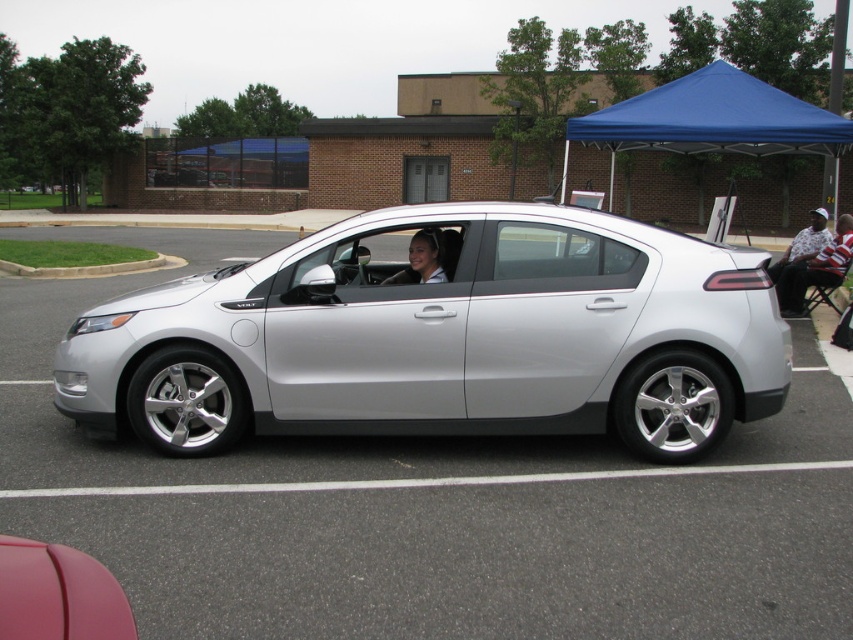
The height and width of the screenshot is (640, 853). What do you see at coordinates (712, 118) in the screenshot?
I see `blue fabric canopy at upper right` at bounding box center [712, 118].

Between point (669, 136) and point (413, 241), which one is positioned behind?

The point (669, 136) is more distant.

Is point (666, 86) farther from camera compared to point (412, 240)?

Yes, it is behind point (412, 240).

You are a GUI agent. You are given a task and a screenshot of the screen. Output one action in this format:
    pyautogui.click(x=<x>, y=<y>)
    Task: Click on the blue fabric canopy at upper right
    This screenshot has width=853, height=640.
    Given the screenshot: What is the action you would take?
    pyautogui.click(x=712, y=118)

Who is taller, silver metallic sedan at center or blue fabric canopy at upper right?

Standing taller between the two is blue fabric canopy at upper right.

What do you see at coordinates (444, 337) in the screenshot? I see `silver metallic sedan at center` at bounding box center [444, 337].

The width and height of the screenshot is (853, 640). Describe the element at coordinates (444, 337) in the screenshot. I see `silver metallic sedan at center` at that location.

Where is `silver metallic sedan at center`? silver metallic sedan at center is located at coordinates (444, 337).

Between silver metallic car at center and white shirt at right, which one appears on the left side from the viewer's perspective?

silver metallic car at center

Does point (234, 486) come behind point (815, 262)?

No, it is in front of (815, 262).

Between point (422, 541) and point (846, 250), which one is positioned in front?

Point (422, 541) is more forward.

I want to click on silver metallic car at center, so click(428, 508).